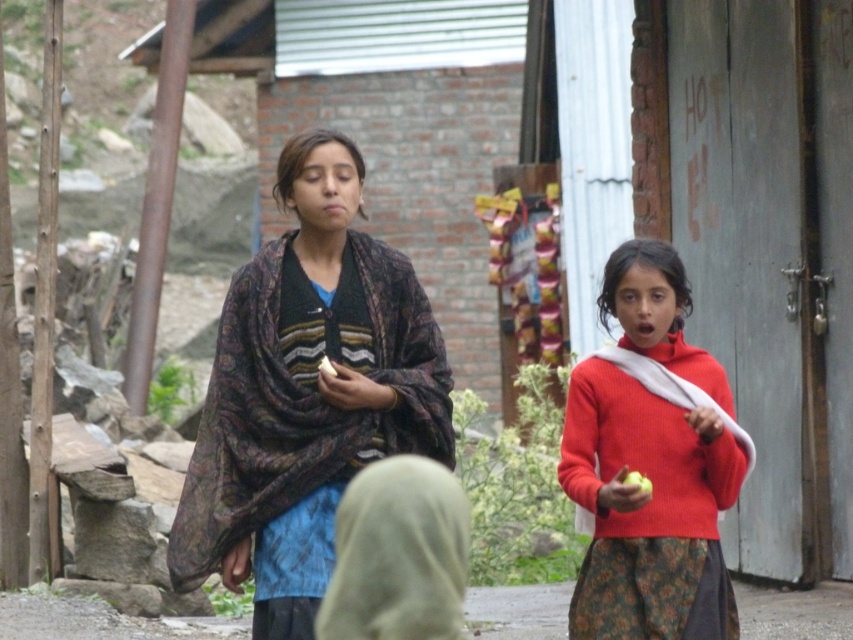
Is matte red sweater at center thinner than matte white shawl at right?

No, matte red sweater at center is not thinner than matte white shawl at right.

Which is more to the right, matte red sweater at center or matte white shawl at right?

matte white shawl at right

Describe the element at coordinates (648, 509) in the screenshot. I see `matte red sweater at center` at that location.

Identify the location of matte red sweater at center. The image size is (853, 640). (648, 509).

Between patterned fabric shawl at center and matte red sweater at center, which one is positioned lower?

matte red sweater at center is lower down.

Between point (241, 461) and point (625, 426), which one is positioned in front?

Point (241, 461) is more forward.

This screenshot has height=640, width=853. Find the location of `patterned fabric shawl at center`. patterned fabric shawl at center is located at coordinates (306, 394).

Is patterned fabric shawl at center smaller than matte white shawl at right?

No, patterned fabric shawl at center is not smaller than matte white shawl at right.

Which is in front, point (225, 483) or point (656, 385)?

Point (225, 483) is in front.

Who is more forward, (x=380, y=285) or (x=642, y=380)?

Point (x=380, y=285)

Image resolution: width=853 pixels, height=640 pixels. I want to click on patterned fabric shawl at center, so click(306, 394).